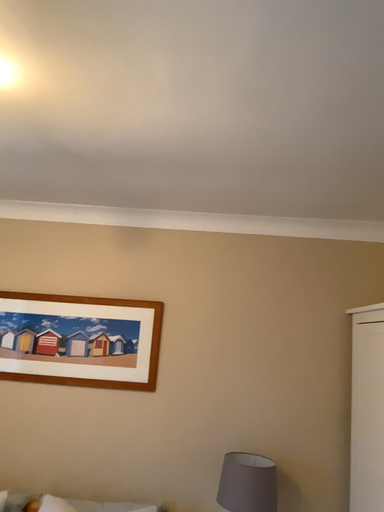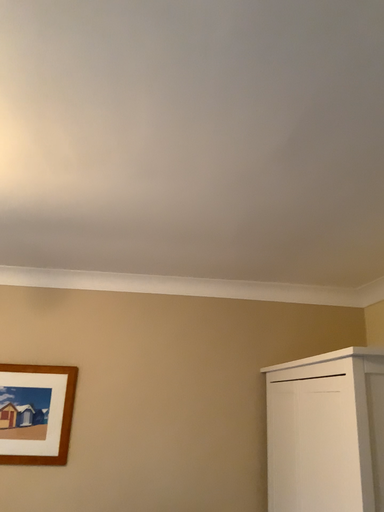
Question: How did the camera likely rotate when shooting the video?

Choices:
 (A) rotated left
 (B) rotated right

Answer: (B)